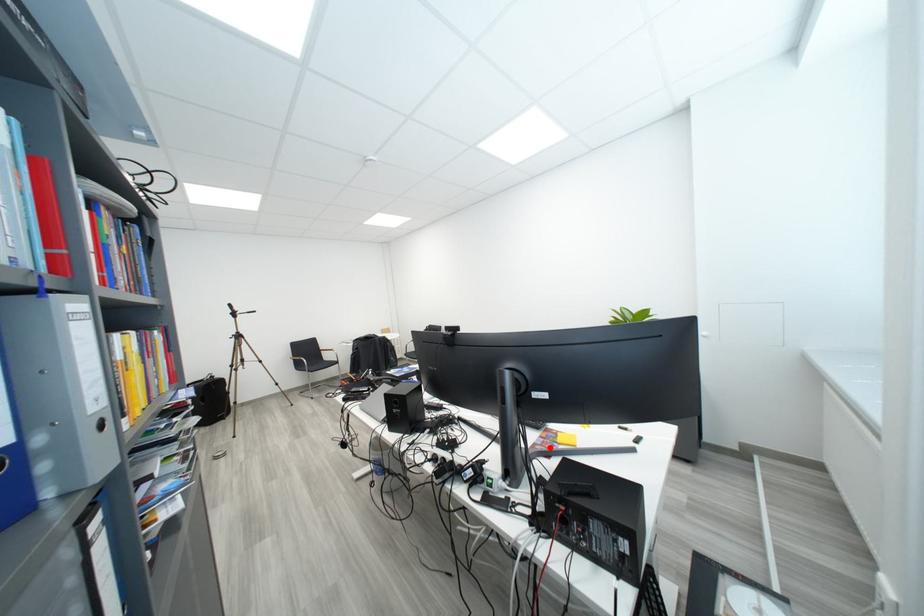
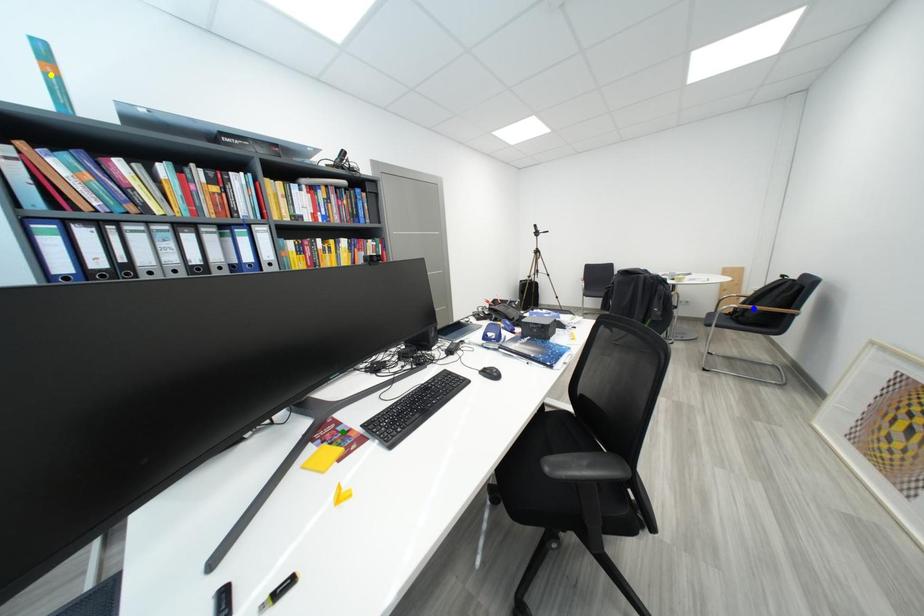
Question: I am providing you with two images of the same scene from different viewpoints. A red point is marked on the first image. You are given multiple points on the second image. Can you choose the point in image 2 that corresponds to the point in image 1?

Choices:
 (A) yellow point
 (B) blue point
 (C) green point

Answer: (C)